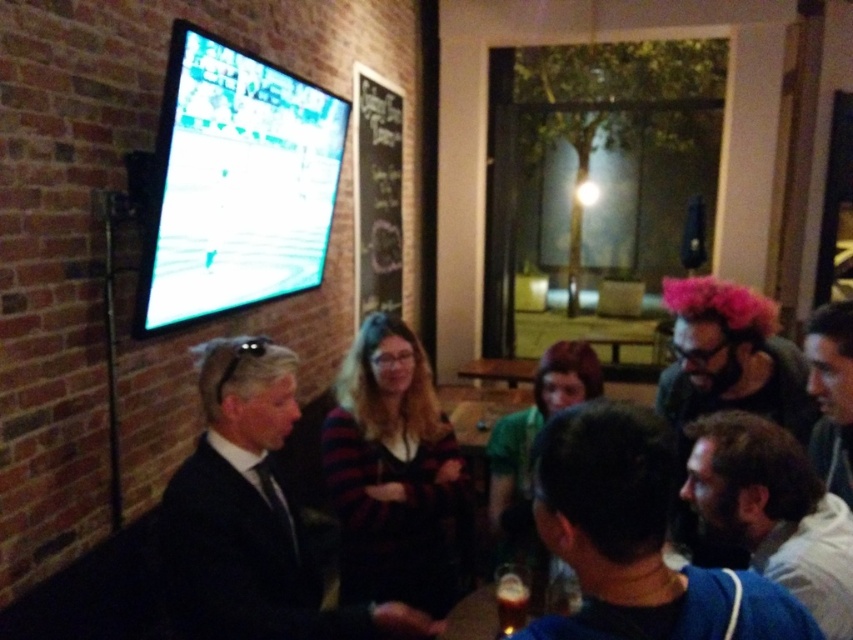
You are a guest at the event and want to sit between the black suit at center and the dark blue fabric at lower right. Is there enough space between them to sit?

The black suit at center is to the left of dark blue fabric at lower right, so there is space between them to sit.

You are at a bar watching a sports game on the TV. You notice a dark blue fabric at lower right and a pink fuzzy wig at upper right. Which object is closer to the floor?

The dark blue fabric at lower right is positioned under the pink fuzzy wig at upper right, so it is closer to the floor.